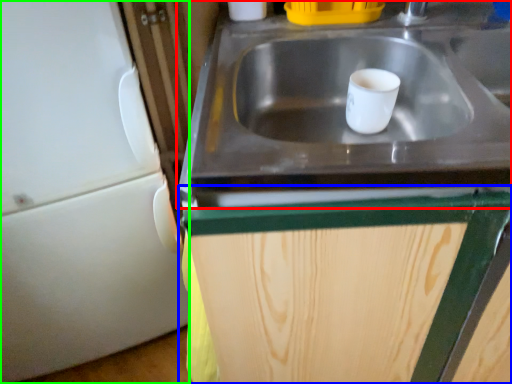
Question: Based on their relative distances, which object is farther from sink (highlighted by a red box)? Choose from cabinetry (highlighted by a blue box) and appliance (highlighted by a green box).

Choices:
 (A) cabinetry
 (B) appliance

Answer: (B)